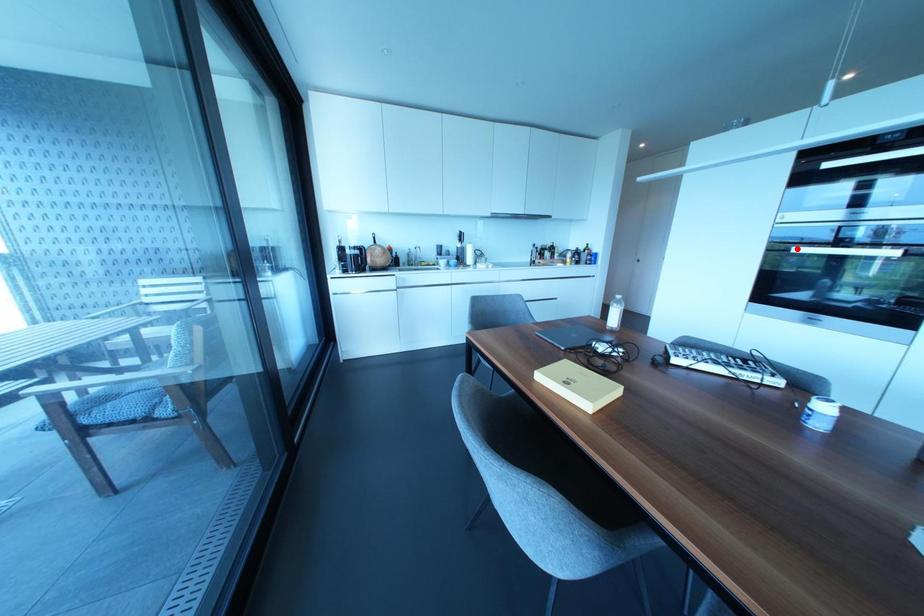
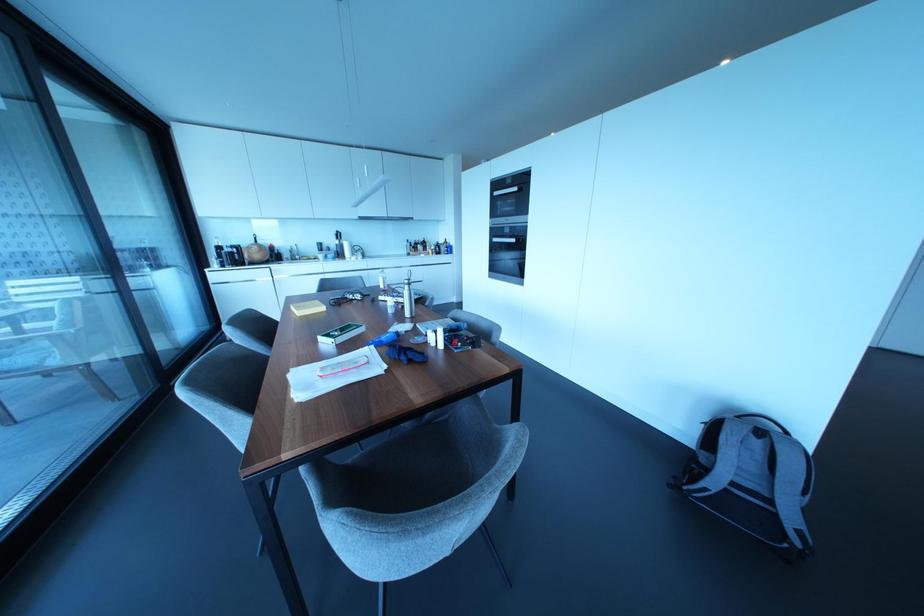
Question: I am providing you with two images of the same scene from different viewpoints. A red point is shown in image1. For the corresponding object point in image2, is it positioned nearer or farther from the camera?

Choices:
 (A) Nearer
 (B) Farther

Answer: (A)